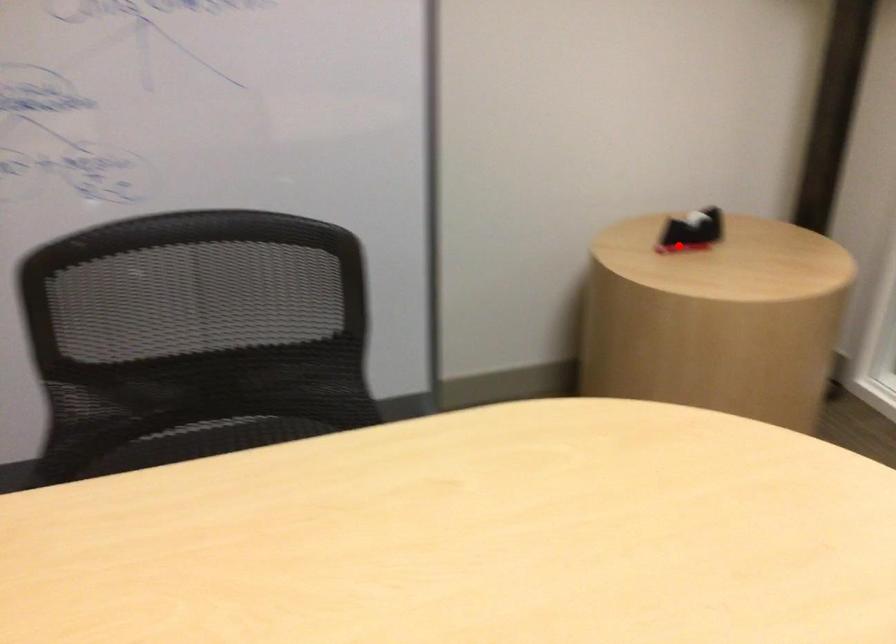
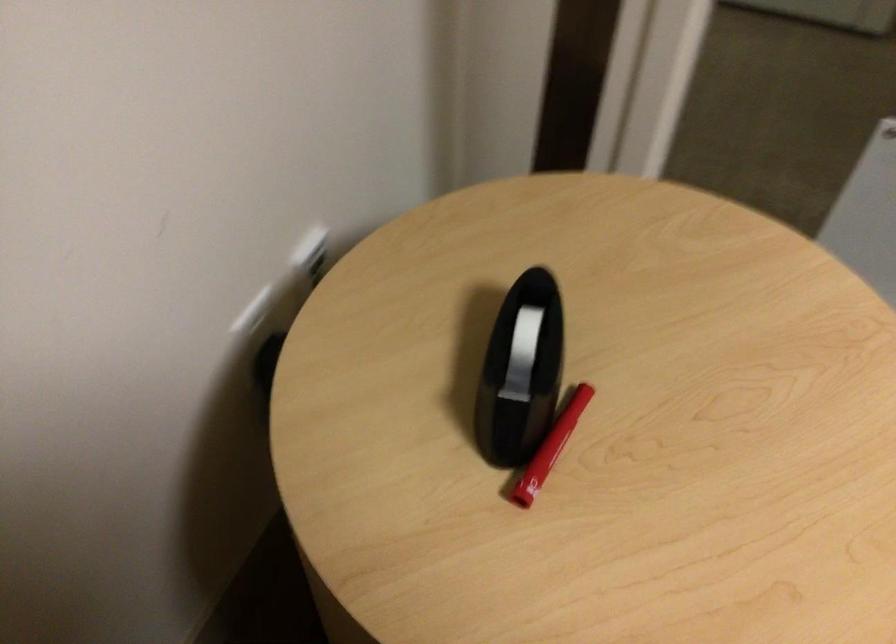
Where in the second image is the point corresponding to the highlighted location from the first image?

(557, 438)